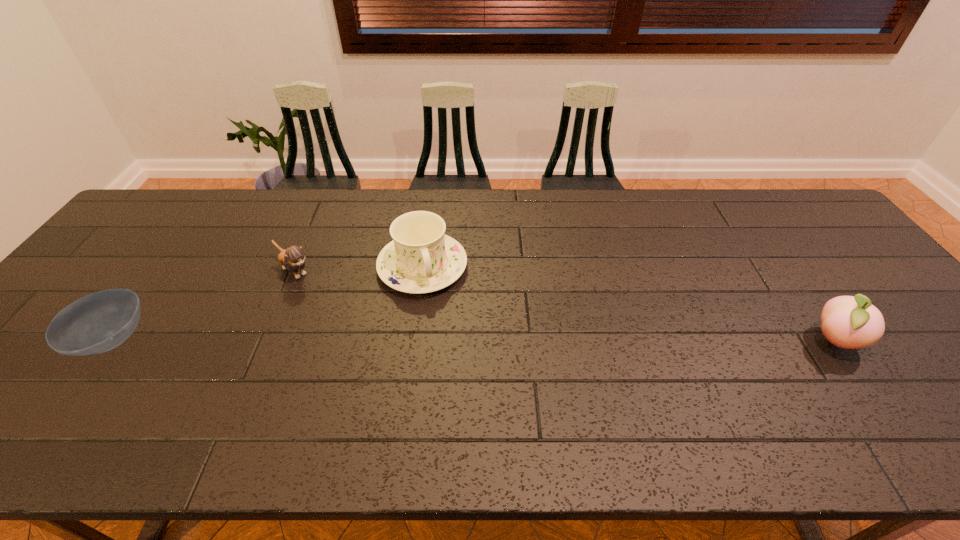
The width and height of the screenshot is (960, 540). In order to click on free space on the desktop that is between the shortest object and the rightmost object and is positioned on the front-facing side of the kitten in this screenshot , I will do `click(375, 340)`.

What are the coordinates of `free spot on the desktop that is between the shortest object and the peach and is positioned on the handle side of the third object from left to right` in the screenshot? It's located at (446, 340).